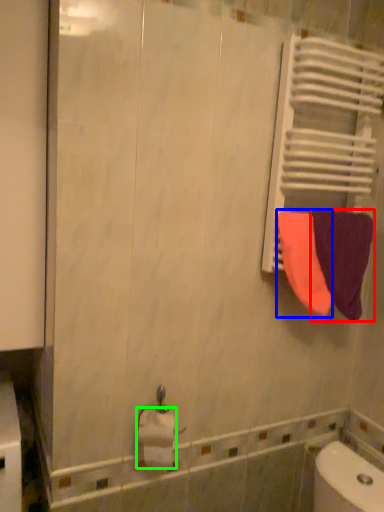
Question: Based on their relative distances, which object is farther from towel (highlighted by a red box)? Choose from towel (highlighted by a blue box) and toilet paper (highlighted by a green box).

Choices:
 (A) towel
 (B) toilet paper

Answer: (B)